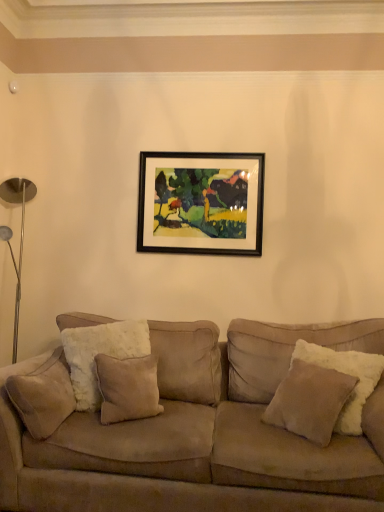
I want to click on black framed painting at upper center, so click(201, 203).

At what (x,y) coordinates should I click in order to perform the action: click on picture frame behind the beige suede pillow at right, the 2th pillow viewed from the left. Please return your answer as a coordinate pair (x, y). Looking at the image, I should click on (201, 203).

Between beige suede pillow at right, the 2th pillow viewed from the left, and black framed painting at upper center, which one has smaller width?

black framed painting at upper center is thinner.

Is beige suede pillow at right, the 2th pillow viewed from the left, surrounding black framed painting at upper center?

No, beige suede pillow at right, the 2th pillow viewed from the left, does not contain black framed painting at upper center.

Is suede couch at center positioned beyond the bounds of suede/velvet pillow at left, placed as the first pillow when sorted from left to right?

Yes, suede couch at center is located beyond the bounds of suede/velvet pillow at left, placed as the first pillow when sorted from left to right.

Which is more to the right, suede couch at center or suede/velvet pillow at left, placed as the first pillow when sorted from left to right?

Positioned to the right is suede couch at center.

Where is `the 2nd pillow behind when counting from the suede couch at center`? the 2nd pillow behind when counting from the suede couch at center is located at coordinates (43, 395).

Considering the relative sizes of suede couch at center and suede/velvet pillow at left, placed as the first pillow when sorted from left to right, in the image provided, is suede couch at center taller than suede/velvet pillow at left, placed as the first pillow when sorted from left to right,?

Indeed, suede couch at center has a greater height compared to suede/velvet pillow at left, placed as the first pillow when sorted from left to right.

How much distance is there between suede/velvet pillow at left, placed as the first pillow when sorted from left to right, and black framed painting at upper center?

They are 1.34 meters apart.

Is suede/velvet pillow at left, the second pillow when ordered from right to left, facing towards black framed painting at upper center?

No, suede/velvet pillow at left, the second pillow when ordered from right to left, is not aimed at black framed painting at upper center.

From a real-world perspective, is suede/velvet pillow at left, the second pillow when ordered from right to left, under black framed painting at upper center?

Yes, from a real-world perspective, suede/velvet pillow at left, the second pillow when ordered from right to left, is under black framed painting at upper center.

Considering the sizes of objects suede/velvet pillow at left, the second pillow when ordered from right to left, and black framed painting at upper center in the image provided, who is shorter, suede/velvet pillow at left, the second pillow when ordered from right to left, or black framed painting at upper center?

suede/velvet pillow at left, the second pillow when ordered from right to left, is shorter.

Does suede/velvet pillow at left, placed as the first pillow when sorted from left to right, come in front of suede couch at center?

That is False.

Visually, is suede/velvet pillow at left, the second pillow when ordered from right to left, positioned to the left or to the right of suede couch at center?

suede/velvet pillow at left, the second pillow when ordered from right to left, is positioned on suede couch at center's left side.

Does suede/velvet pillow at left, placed as the first pillow when sorted from left to right, turn towards suede couch at center?

Yes.

Are suede couch at center and beige suede pillow at right, the 2th pillow viewed from the left, located far from each other?

They are positioned close to each other.

From the image's perspective, is suede couch at center positioned above or below beige suede pillow at right, the 1th pillow when ordered from right to left?

From the image's perspective, suede couch at center appears below beige suede pillow at right, the 1th pillow when ordered from right to left.

In the scene shown: Is the position of suede couch at center less distant than that of beige suede pillow at right, the 2th pillow viewed from the left?

Yes, it is.

Does point (171, 339) lie in front of point (351, 381)?

No, it is not.

Which is in front, beige suede pillow at right, the 2th pillow viewed from the left, or suede couch at center?

suede couch at center is more forward.

Is beige suede pillow at right, the 2th pillow viewed from the left, spatially inside suede couch at center, or outside of it?

beige suede pillow at right, the 2th pillow viewed from the left, is located inside suede couch at center.

Does beige suede pillow at right, the 2th pillow viewed from the left, have a smaller size compared to suede couch at center?

Yes, beige suede pillow at right, the 2th pillow viewed from the left, is smaller than suede couch at center.

From the image's perspective, which object appears higher, suede couch at center or black framed painting at upper center?

From the image's view, black framed painting at upper center is above.

Which object is closer to the camera, suede couch at center or black framed painting at upper center?

suede couch at center is more forward.

Considering the sizes of objects suede couch at center and black framed painting at upper center in the image provided, who is smaller, suede couch at center or black framed painting at upper center?

black framed painting at upper center is smaller.

Is suede couch at center not near black framed painting at upper center?

suede couch at center is far away from black framed painting at upper center.

Find the location of a particular element. This screenshot has height=512, width=384. picture frame lying above the beige suede pillow at right, the 2th pillow viewed from the left (from the image's perspective) is located at coordinates (201, 203).

The height and width of the screenshot is (512, 384). In order to click on pillow that is the 2nd one when counting backward from the suede couch at center in this screenshot , I will do pos(43,395).

Based on their spatial positions, is black framed painting at upper center or suede/velvet pillow at left, placed as the first pillow when sorted from left to right, further from suede couch at center?

black framed painting at upper center is further to suede couch at center.

From the image, which object appears to be farther from black framed painting at upper center, suede couch at center or beige suede pillow at right, the 1th pillow when ordered from right to left?

beige suede pillow at right, the 1th pillow when ordered from right to left, is positioned further to the anchor black framed painting at upper center.

From the image, which object appears to be nearer to black framed painting at upper center, beige suede pillow at right, the 1th pillow when ordered from right to left, or suede couch at center?

Among the two, suede couch at center is located nearer to black framed painting at upper center.

Looking at the image, which one is located further to suede/velvet pillow at left, placed as the first pillow when sorted from left to right, beige suede pillow at right, the 1th pillow when ordered from right to left, or black framed painting at upper center?

Based on the image, black framed painting at upper center appears to be further to suede/velvet pillow at left, placed as the first pillow when sorted from left to right.

Estimate the real-world distances between objects in this image. Which object is closer to suede couch at center, black framed painting at upper center or beige suede pillow at right, the 2th pillow viewed from the left?

beige suede pillow at right, the 2th pillow viewed from the left, lies closer to suede couch at center than the other object.

Estimate the real-world distances between objects in this image. Which object is further from suede/velvet pillow at left, placed as the first pillow when sorted from left to right, beige suede pillow at right, the 1th pillow when ordered from right to left, or suede couch at center?

beige suede pillow at right, the 1th pillow when ordered from right to left.

Estimate the real-world distances between objects in this image. Which object is closer to suede couch at center, suede/velvet pillow at left, the second pillow when ordered from right to left, or beige suede pillow at right, the 1th pillow when ordered from right to left?

Based on the image, beige suede pillow at right, the 1th pillow when ordered from right to left, appears to be nearer to suede couch at center.

Looking at the image, which one is located further to black framed painting at upper center, suede/velvet pillow at left, placed as the first pillow when sorted from left to right, or beige suede pillow at right, the 2th pillow viewed from the left?

suede/velvet pillow at left, placed as the first pillow when sorted from left to right, lies further to black framed painting at upper center than the other object.

The height and width of the screenshot is (512, 384). Find the location of `picture frame situated between suede/velvet pillow at left, the second pillow when ordered from right to left, and beige suede pillow at right, the 1th pillow when ordered from right to left, from left to right`. picture frame situated between suede/velvet pillow at left, the second pillow when ordered from right to left, and beige suede pillow at right, the 1th pillow when ordered from right to left, from left to right is located at coordinates (201, 203).

This screenshot has width=384, height=512. I want to click on studio couch between suede/velvet pillow at left, placed as the first pillow when sorted from left to right, and beige suede pillow at right, the 2th pillow viewed from the left, from left to right, so click(x=201, y=434).